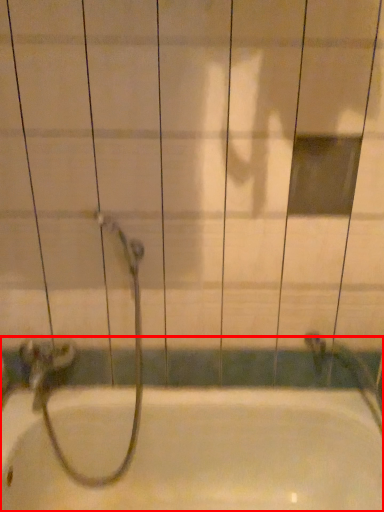
Question: Where is bathtub (annotated by the red box) located in relation to garden hose in the image?

Choices:
 (A) right
 (B) left

Answer: (A)